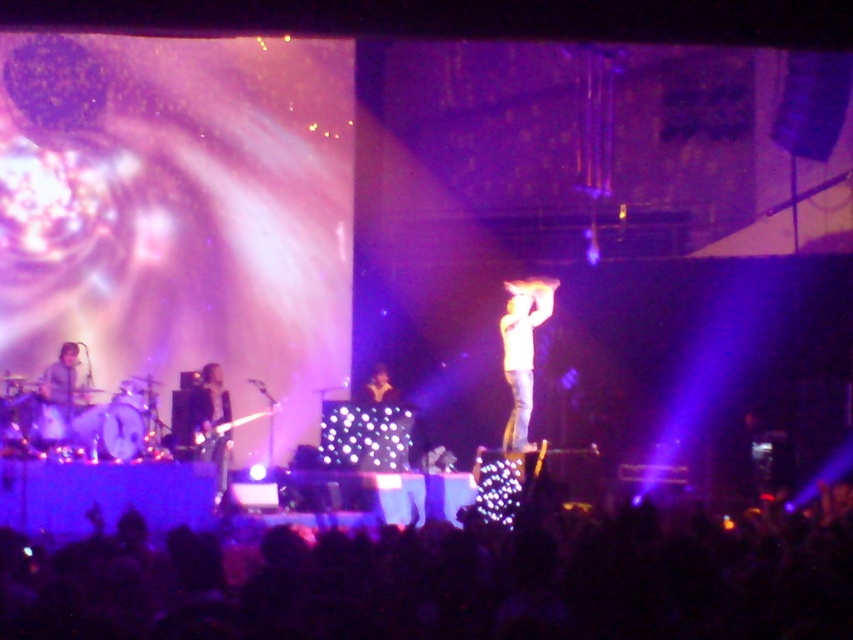
You are a photographer at the concert. You want to capture a closeup of the shiny black guitar at lower left and the matte gray shirt at left. Which object should you zoom in on first to ensure it fits in the frame?

The shiny black guitar at lower left is taller than the matte gray shirt at left, so you should zoom in on the shiny black guitar at lower left first to ensure it fits in the frame before adjusting for the smaller matte gray shirt at left.

You are a photographer at the concert and want to capture both the shiny black guitar at lower left and the matte gray shirt at left in the same frame. Which object should you zoom in on to ensure both are visible without cropping?

The shiny black guitar at lower left has a lesser width compared to matte gray shirt at left. To include both in the frame without cropping, you should zoom in on the wider object, which is the matte gray shirt at left, allowing the narrower shiny black guitar at lower left to fit alongside.